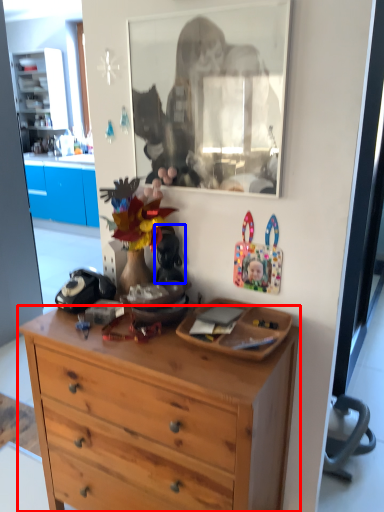
Question: Which object is closer to the camera taking this photo, desk (highlighted by a red box) or toy (highlighted by a blue box)?

Choices:
 (A) desk
 (B) toy

Answer: (A)